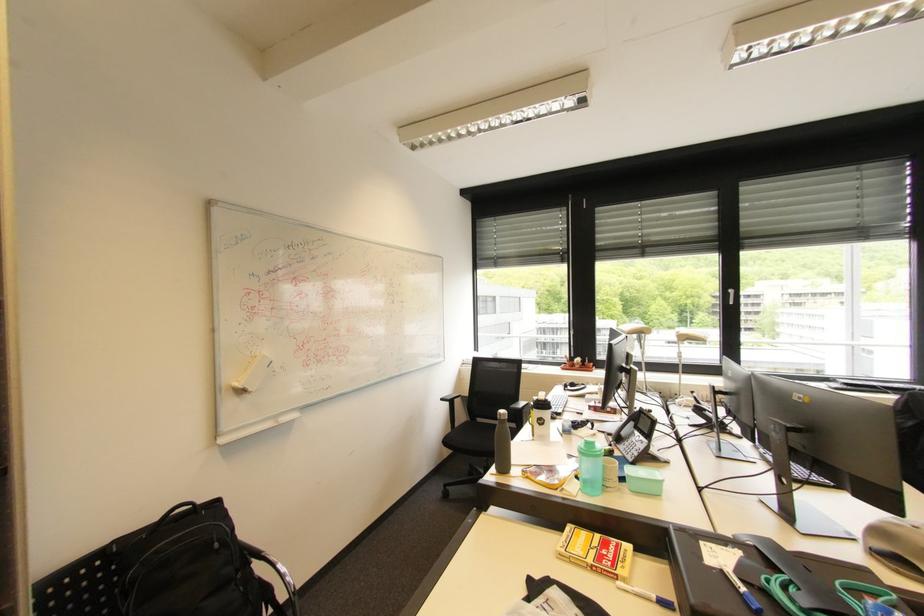
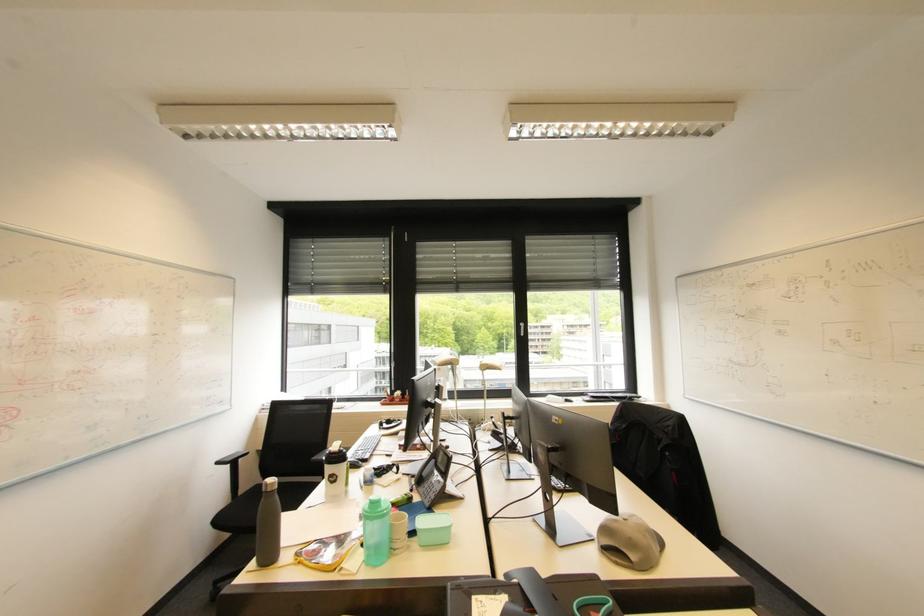
In a continuous first-person perspective shot, in which direction is the camera moving?

The cameraman walked toward right, forward.